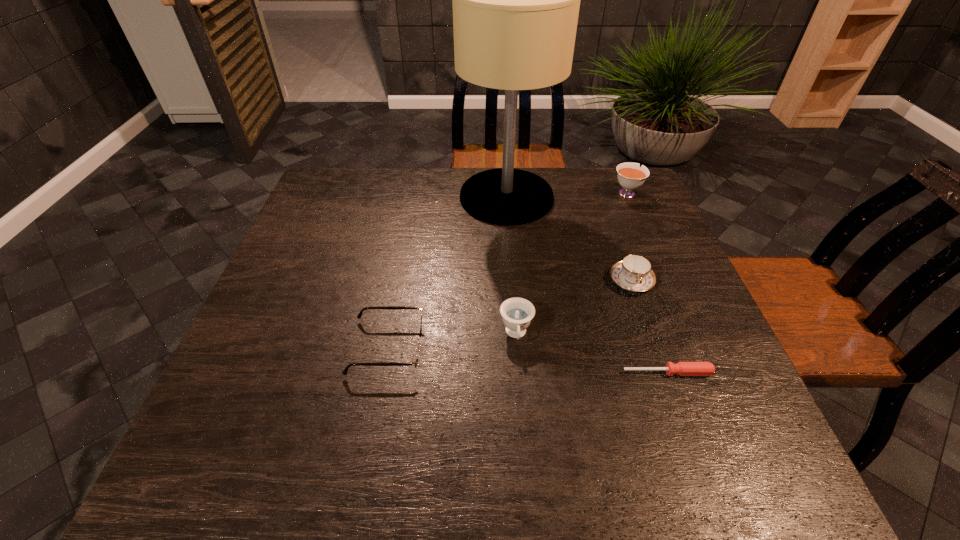
You are a GUI agent. You are given a task and a screenshot of the screen. Output one action in this format:
    pyautogui.click(x=<x>, y=<y>)
    Task: Click on the free space located 0.060m on the side of the farthest teacup with the handle
    
    Given the screenshot: What is the action you would take?
    pyautogui.click(x=618, y=173)

This screenshot has height=540, width=960. In order to click on blank area located 0.060m on the side of the farthest teacup with the handle in this screenshot , I will do `click(618, 173)`.

Find the location of a particular element. The image size is (960, 540). vacant position located on the side of the fourth shortest object with the handle is located at coordinates (526, 467).

Locate an element on the screen. The image size is (960, 540). vacant position located on the side with the handle of the second nearest teacup is located at coordinates (658, 357).

At what (x,y) coordinates should I click in order to perform the action: click on vacant space located 0.100m at the hinge ends of the leftmost object. Please return your answer as a coordinate pair (x, y). Looking at the image, I should click on (470, 347).

Identify the location of free space located 0.330m on the back of the shortest object. The image size is (960, 540). (627, 260).

In order to click on table lamp that is at the far edge in this screenshot , I will do `click(516, 0)`.

Locate an element on the screen. teacup present at the far edge is located at coordinates (631, 176).

The width and height of the screenshot is (960, 540). I want to click on screwdriver positioned at the right edge, so click(681, 368).

You are a GUI agent. You are given a task and a screenshot of the screen. Output one action in this format:
    pyautogui.click(x=<x>, y=<y>)
    Task: Click on the object present at the far right corner
    
    Given the screenshot: What is the action you would take?
    pyautogui.click(x=631, y=176)